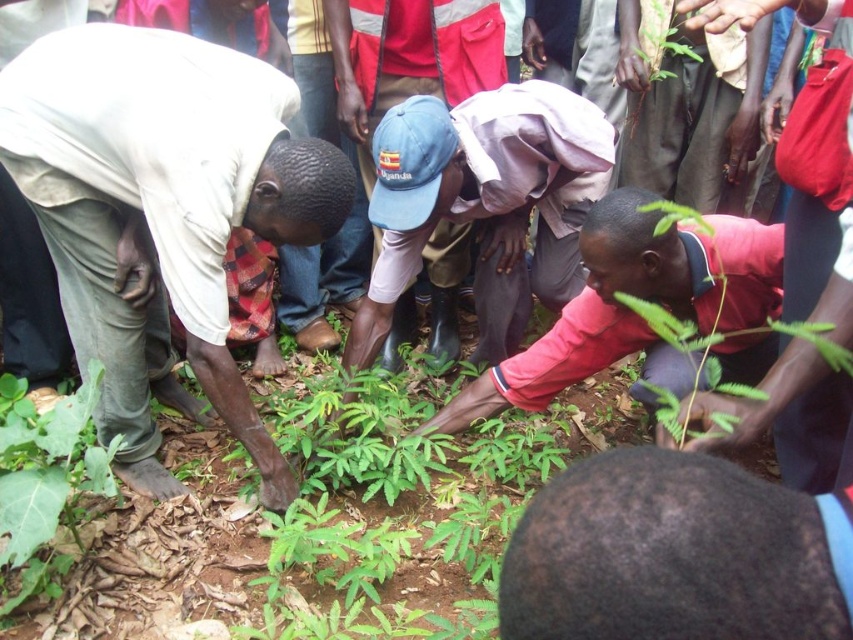
Which is below, dark brown hair at lower center or green leafy plant at upper right?

dark brown hair at lower center

Between dark brown hair at lower center and green leafy plant at upper right, which one has less height?

With less height is dark brown hair at lower center.

Is point (668, 520) positioned behind point (689, 84)?

No, it is not.

I want to click on dark brown hair at lower center, so click(668, 556).

Does blue rubber boots at center appear on the left side of green leafy plant at lower left?

In fact, blue rubber boots at center is to the right of green leafy plant at lower left.

Is point (541, 182) positioned in front of point (54, 588)?

That is False.

Does point (390, 109) come behind point (3, 612)?

Yes, point (390, 109) is farther from viewer.

The width and height of the screenshot is (853, 640). Identify the location of blue rubber boots at center. (483, 198).

Between light beige fabric at lower left and green leafy plant at lower left, which one has more height?

light beige fabric at lower left is taller.

Can you confirm if light beige fabric at lower left is smaller than green leafy plant at lower left?

Incorrect, light beige fabric at lower left is not smaller in size than green leafy plant at lower left.

Is point (78, 288) positioned before point (32, 410)?

That is True.

Identify the location of light beige fabric at lower left. (161, 214).